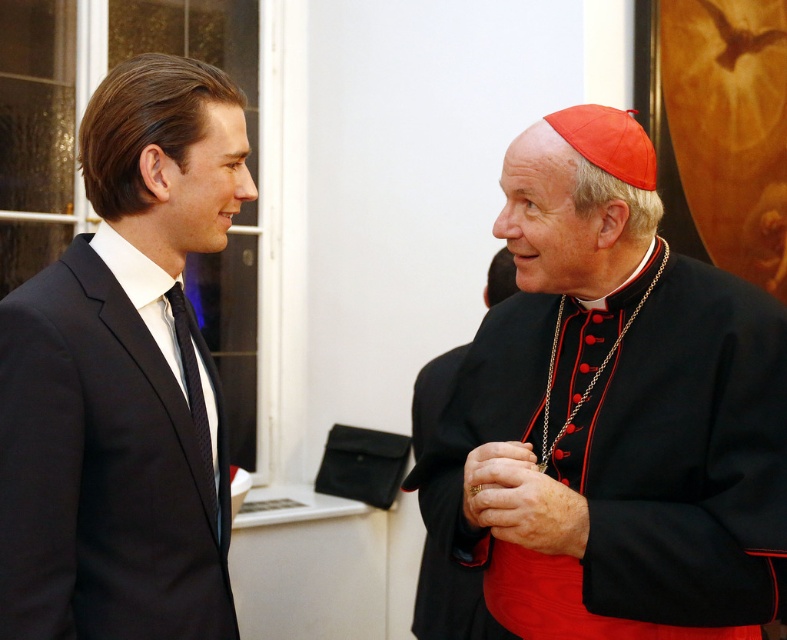
Consider the image. Which is more to the right, black satin cassock at center or black satin robe at right?

black satin cassock at center

Does point (510, 580) lie behind point (468, 620)?

No, (510, 580) is closer to viewer.

Does point (503, 374) lie in front of point (510, 294)?

Yes, it is.

Locate an element on the screen. black satin cassock at center is located at coordinates (612, 412).

Between matte black suit at left and black satin robe at right, which one is positioned higher?

Positioned higher is matte black suit at left.

I want to click on matte black suit at left, so click(124, 378).

Where is `matte black suit at left`? The height and width of the screenshot is (640, 787). matte black suit at left is located at coordinates (124, 378).

Does black satin cassock at center have a lesser width compared to matte black suit at left?

In fact, black satin cassock at center might be wider than matte black suit at left.

Consider the image. Does black satin cassock at center appear over matte black suit at left?

No.

You are a GUI agent. You are given a task and a screenshot of the screen. Output one action in this format:
    pyautogui.click(x=<x>, y=<y>)
    Task: Click on the black satin cassock at center
    The image size is (787, 640).
    Given the screenshot: What is the action you would take?
    pyautogui.click(x=612, y=412)

Locate an element on the screen. Image resolution: width=787 pixels, height=640 pixels. black satin cassock at center is located at coordinates (612, 412).